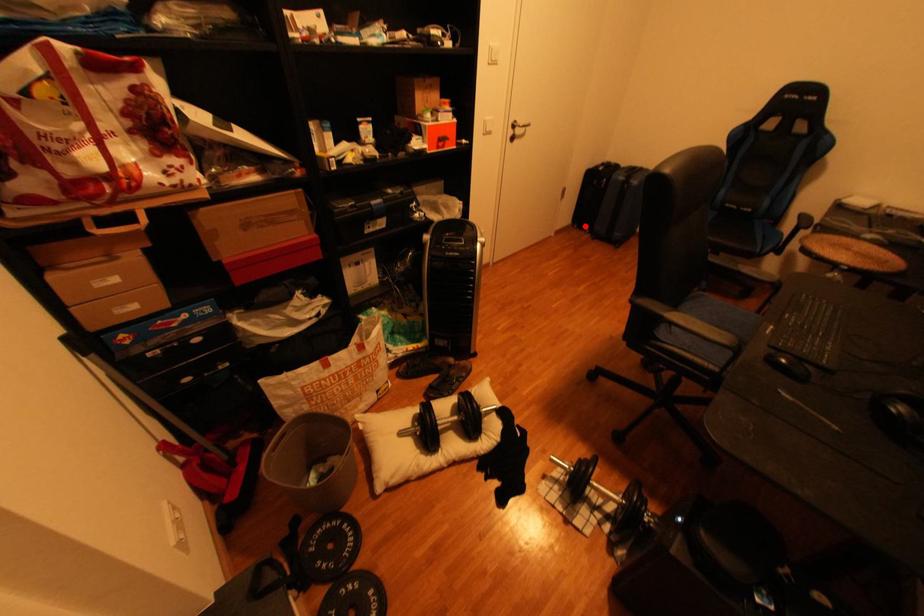
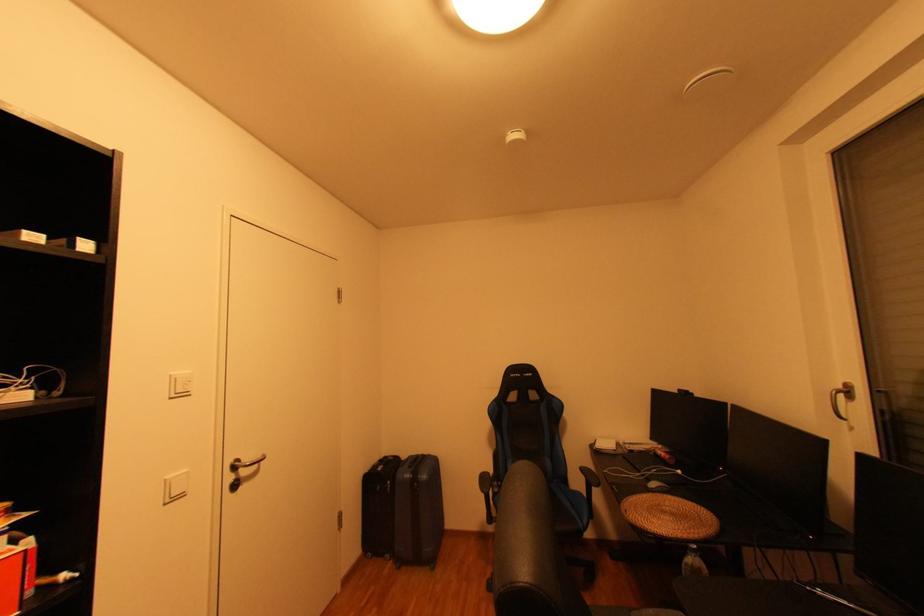
Question: I am providing you with two images of the same scene from different viewpoints. A red point is marked on the first image. Is the red point's position out of view in image 2?

Choices:
 (A) Yes
 (B) No

Answer: (B)